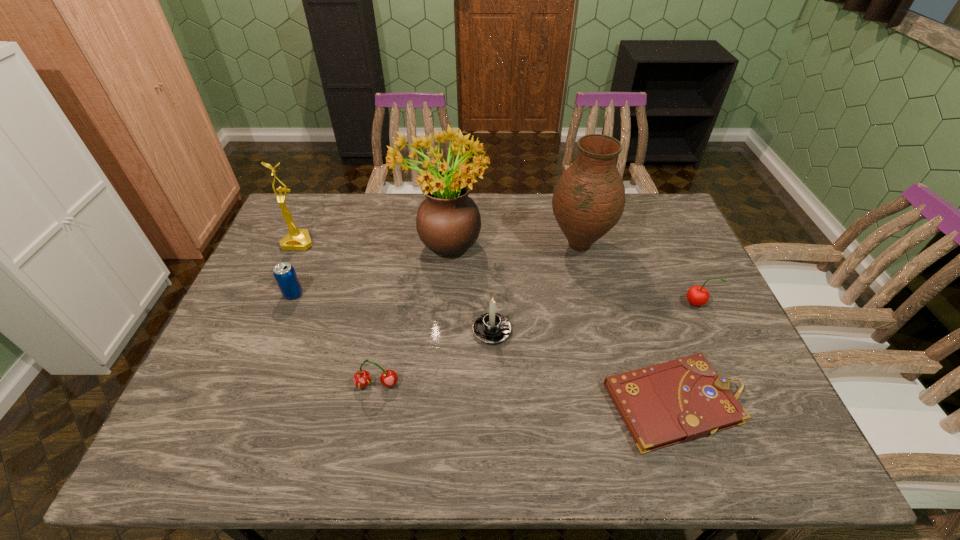
You are a GUI agent. You are given a task and a screenshot of the screen. Output one action in this format:
    pyautogui.click(x=<x>, y=<y>)
    Task: Click on the vacant space at the right edge of the desktop
    
    Given the screenshot: What is the action you would take?
    pyautogui.click(x=681, y=321)

Where is `vacant space that is in between the flower arrangement and the notebook`? vacant space that is in between the flower arrangement and the notebook is located at coordinates (561, 323).

Locate an element on the screen. This screenshot has height=540, width=960. vacant space in between the shortest object and the candle holder is located at coordinates (585, 367).

You are a GUI agent. You are given a task and a screenshot of the screen. Output one action in this format:
    pyautogui.click(x=<x>, y=<y>)
    Task: Click on the free space between the vase and the pop soda
    The width and height of the screenshot is (960, 540).
    Given the screenshot: What is the action you would take?
    pyautogui.click(x=436, y=269)

At what (x,y) coordinates should I click in order to perform the action: click on blank region between the pop soda and the award. Please return your answer as a coordinate pair (x, y). The height and width of the screenshot is (540, 960). Looking at the image, I should click on (296, 268).

At what (x,y) coordinates should I click in order to perform the action: click on free spot between the pop soda and the flower arrangement. Please return your answer as a coordinate pair (x, y). Image resolution: width=960 pixels, height=540 pixels. Looking at the image, I should click on (369, 269).

You are a GUI agent. You are given a task and a screenshot of the screen. Output one action in this format:
    pyautogui.click(x=<x>, y=<y>)
    Task: Click on the vacant space in between the nearer cherry and the sixth farthest object
    
    Given the screenshot: What is the action you would take?
    pyautogui.click(x=434, y=357)

The image size is (960, 540). I want to click on free spot between the vase and the right cherry, so click(637, 274).

Find the location of a particular element. This screenshot has width=960, height=540. vacant space that is in between the shorter cherry and the notebook is located at coordinates (527, 394).

Choose which object is the nearest neighbor to the flower arrangement. Please provide its 2D coordinates. Your answer should be formatted as a tuple, i.e. [(x, y)], where the tuple contains the x and y coordinates of a point satisfying the conditions above.

[(492, 328)]